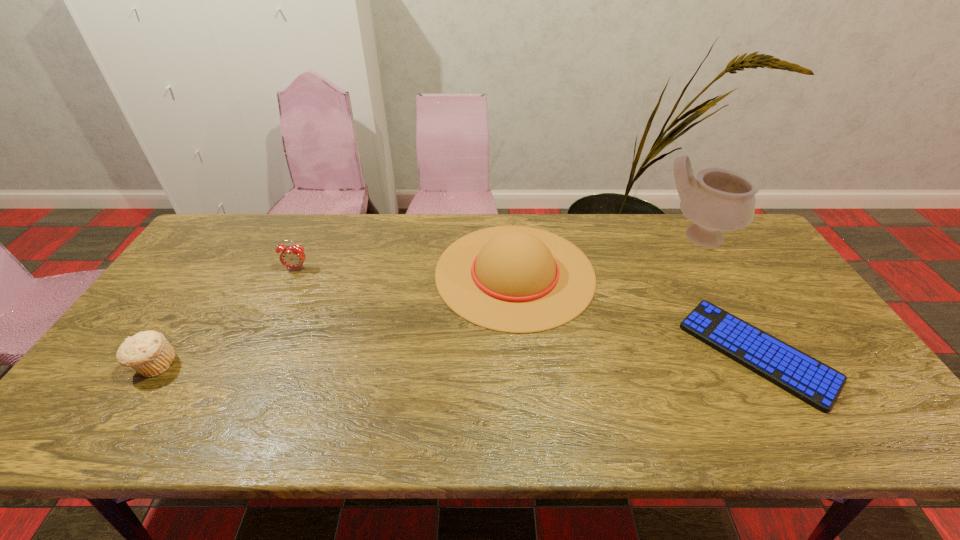
Where is `free space between the tallest object and the leftmost object`? free space between the tallest object and the leftmost object is located at coordinates (426, 301).

At what (x,y) coordinates should I click in order to perform the action: click on free point between the pottery and the shortest object. Please return your answer as a coordinate pair (x, y). The width and height of the screenshot is (960, 540). Looking at the image, I should click on (727, 295).

This screenshot has width=960, height=540. What are the coordinates of `free spot between the leftmost object and the sombrero` in the screenshot? It's located at (335, 319).

Identify which object is located as the nearest to the computer keyboard. Please provide its 2D coordinates. Your answer should be formatted as a tuple, i.e. [(x, y)], where the tuple contains the x and y coordinates of a point satisfying the conditions above.

[(514, 279)]

Image resolution: width=960 pixels, height=540 pixels. I want to click on object that is the fourth closest to the fourth object from right to left, so click(718, 200).

At what (x,y) coordinates should I click in order to perform the action: click on vacant region that satisfies the following two spatial constraints: 1. on the back side of the tallest object; 2. on the right side of the sombrero. Please return your answer as a coordinate pair (x, y). This screenshot has width=960, height=540. Looking at the image, I should click on (512, 237).

Find the location of a particular element. free space that satisfies the following two spatial constraints: 1. on the back side of the shortest object; 2. on the right side of the pottery is located at coordinates (689, 237).

At what (x,y) coordinates should I click in order to perform the action: click on vacant space that satisfies the following two spatial constraints: 1. on the face of the fourth object from right to left; 2. on the right side of the third object from left to right. Please return your answer as a coordinate pair (x, y). This screenshot has height=540, width=960. Looking at the image, I should click on (295, 273).